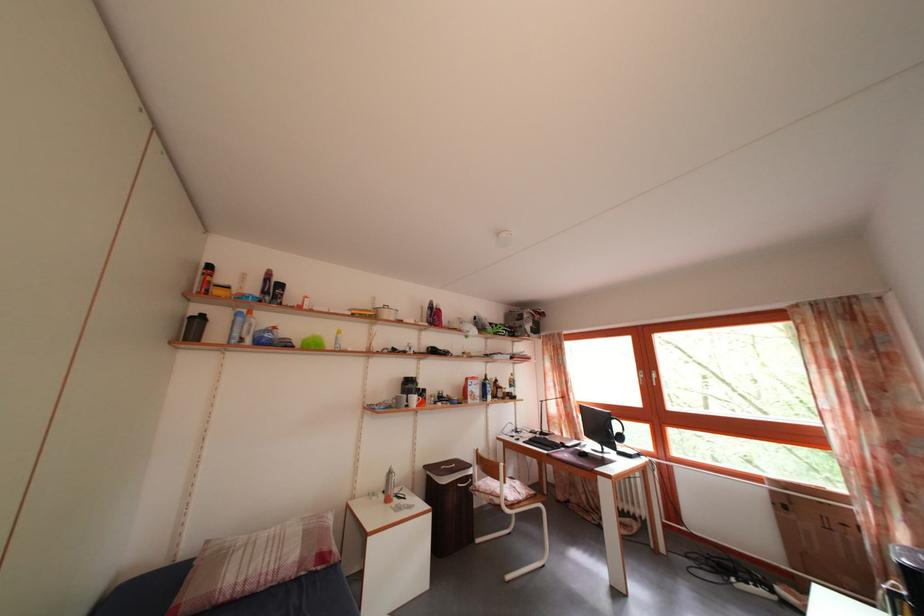
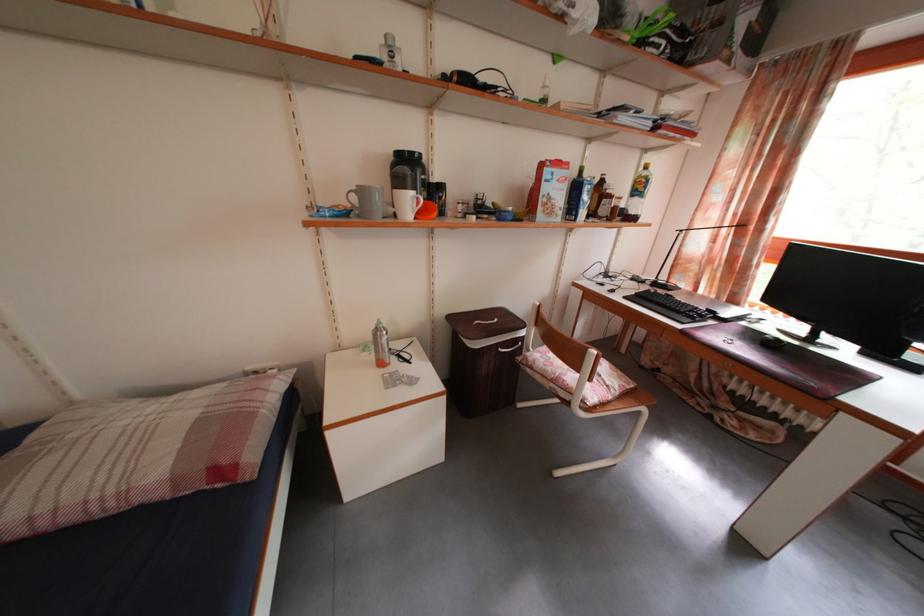
In the second image, find the point that corresponds to point (553, 437) in the first image.

(671, 285)